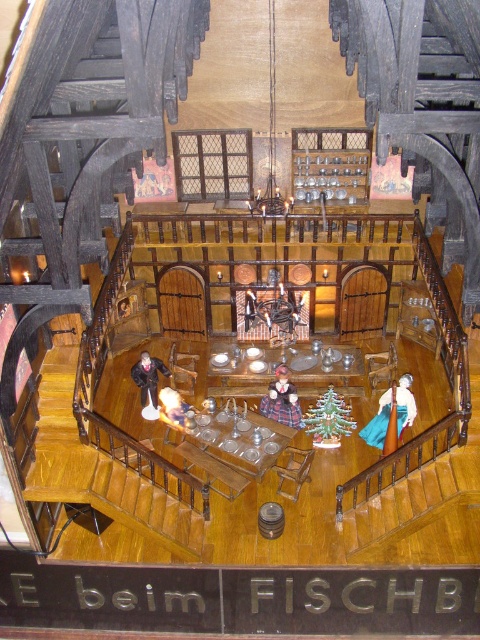
You are standing in the medieval model room and notice a blue fabric dress at lower right. Where exactly is it positioned in the room?

The blue fabric dress at lower right is located at point 0.650 in the x coordinate and 0.815 in the y coordinate.

You are organizing a medieval costume display and need to decide which costume to place on a mannequin. The mannequin can only accommodate larger costumes. Which costume should you choose between the blue fabric dress at lower right and the black velvet coat at center?

The blue fabric dress at lower right is larger in size than the black velvet coat at center, so you should choose the blue fabric dress at lower right for the mannequin.